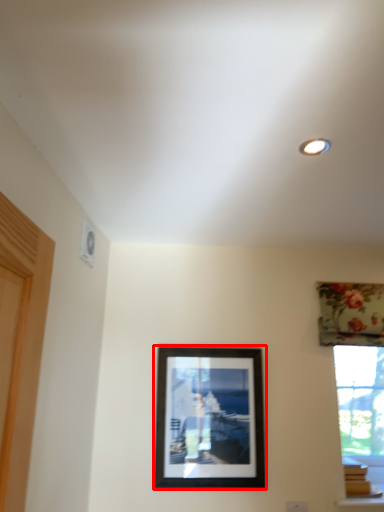
Question: From the image's perspective, considering the relative positions of picture frame (annotated by the red box) and curtain in the image provided, where is picture frame (annotated by the red box) located with respect to the staircase?

Choices:
 (A) below
 (B) above

Answer: (A)